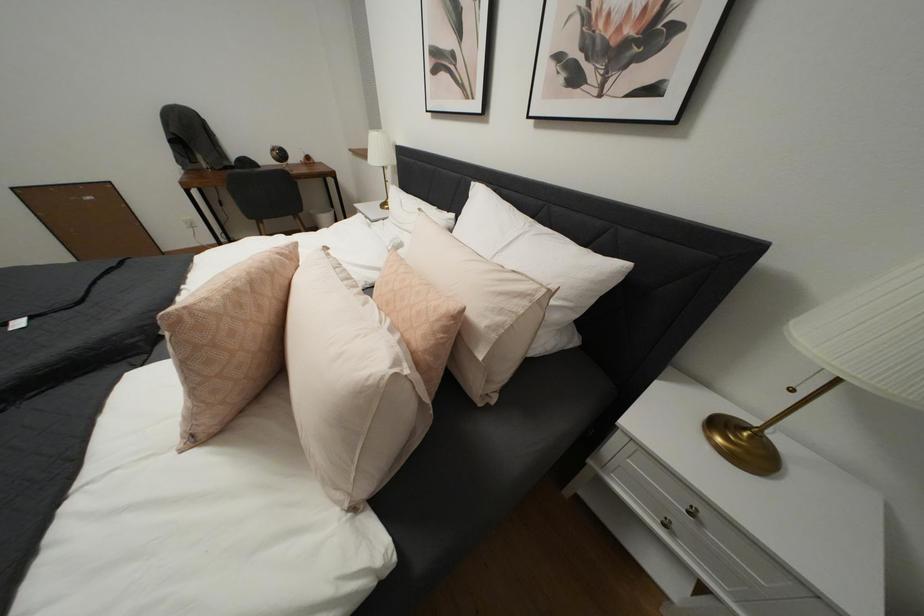
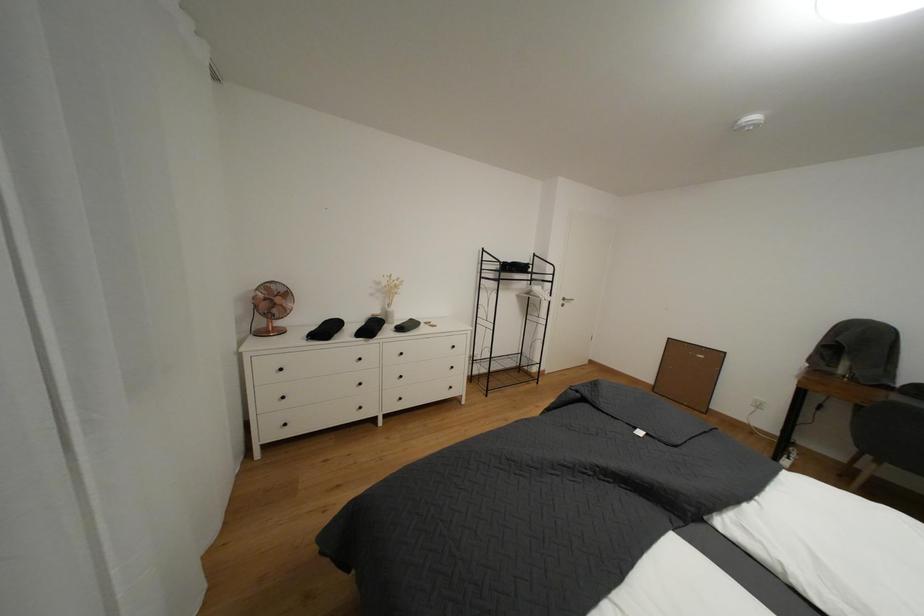
Question: The camera is either moving clockwise (left) or counter-clockwise (right) around the object. The first image is from the beginning of the video and the second image is from the end. Is the camera moving left or right when shooting the video?

Choices:
 (A) Left
 (B) Right

Answer: (B)